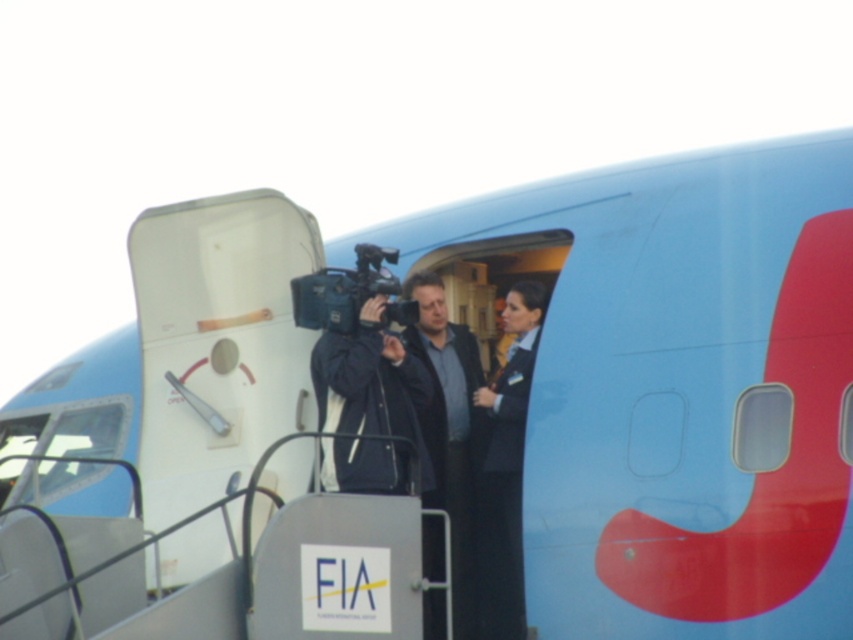
Question: Which point is farther from the camera taking this photo?

Choices:
 (A) (515, 595)
 (B) (440, 408)

Answer: (B)

Question: Is black fabric uniform at center in front of matte black video camera at center?

Choices:
 (A) no
 (B) yes

Answer: (A)

Question: Estimate the real-world distances between objects in this image. Which object is farther from the black fabric uniform at center?

Choices:
 (A) matte black video camera at center
 (B) dark blue fabric jacket at center

Answer: (A)

Question: Can you confirm if black fabric uniform at center is smaller than matte black video camera at center?

Choices:
 (A) yes
 (B) no

Answer: (B)

Question: Can you confirm if black fabric uniform at center is bigger than matte black video camera at center?

Choices:
 (A) no
 (B) yes

Answer: (B)

Question: Which object is farther from the camera taking this photo?

Choices:
 (A) black fabric uniform at center
 (B) dark blue fabric jacket at center
 (C) matte black video camera at center

Answer: (A)